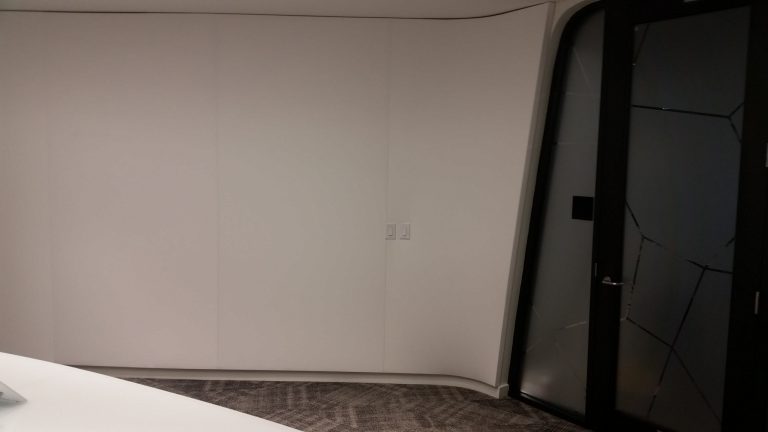
Where is `decorative pattern on carpet/ white`? Image resolution: width=768 pixels, height=432 pixels. decorative pattern on carpet/ white is located at coordinates (306, 403).